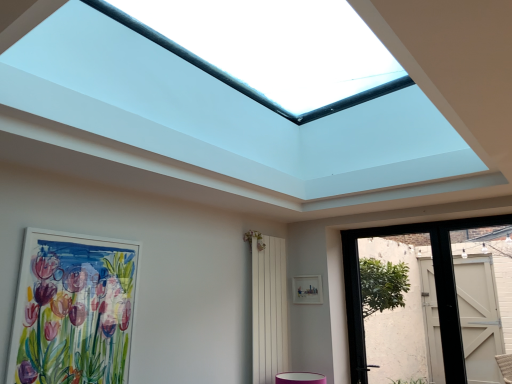
The width and height of the screenshot is (512, 384). Identify the location of empty space that is ontop of matte white picture frame at left, acting as the 2th picture frame starting from the back (from a real-world perspective). pyautogui.click(x=83, y=231).